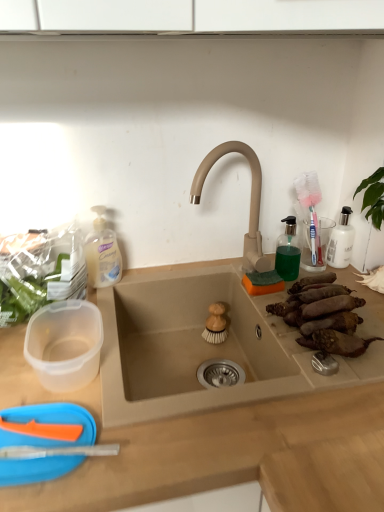
Question: Considering the positions of translucent plastic soap dispenser at left and transparent plastic soap dispenser at upper right in the image, is translucent plastic soap dispenser at left taller or shorter than transparent plastic soap dispenser at upper right?

Choices:
 (A) tall
 (B) short

Answer: (A)

Question: Relative to transparent plastic soap dispenser at upper right, is translucent plastic soap dispenser at left in front or behind?

Choices:
 (A) behind
 (B) front

Answer: (B)

Question: Estimate the real-world distances between objects in this image. Which object is closer to the wooden brush at sink, the second food when ordered from front to back?

Choices:
 (A) brown rough sweet potatoes at right sink, acting as the second food starting from the left
 (B) translucent plastic soap dispenser at left
 (C) beige matte sink at center
 (D) transparent plastic soap dispenser at upper right
 (E) beige matte faucet at center

Answer: (D)

Question: Estimate the real-world distances between objects in this image. Which object is closer to the wooden brush at sink, arranged as the 1th food when viewed from the left?

Choices:
 (A) beige matte faucet at center
 (B) brown rough sweet potatoes at right sink, acting as the second food starting from the left
 (C) beige matte sink at center
 (D) transparent plastic soap dispenser at upper right
 (E) translucent plastic soap dispenser at left

Answer: (D)